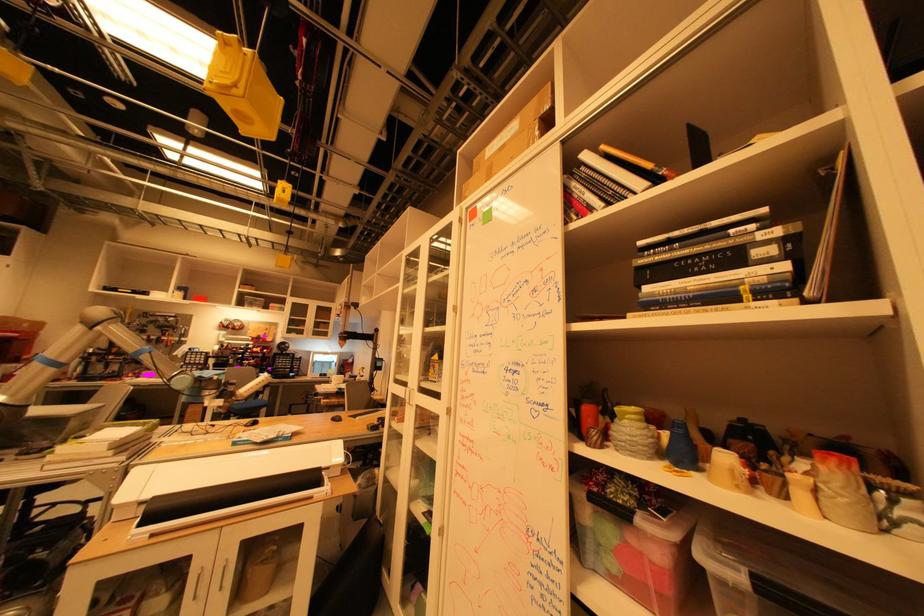
Where would you lift the white printer cover? Please return your answer as a coordinate pair (x, y).

(221, 472)